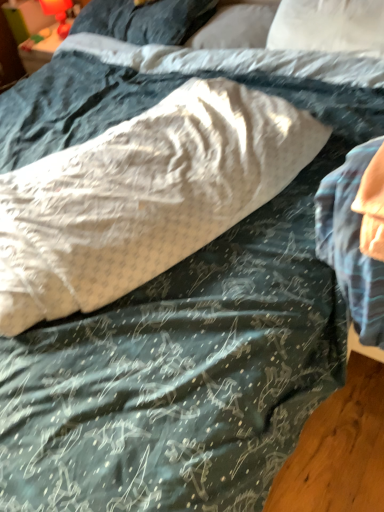
Question: In terms of width, does white textured pillow at center, which appears as the fourth pillow when viewed from the top, look wider or thinner when compared to white soft pillow at upper center, the second pillow in the bottom-to-top sequence?

Choices:
 (A) wide
 (B) thin

Answer: (A)

Question: From the image's perspective, is white textured pillow at center, which appears as the fourth pillow when viewed from the top, located above or below white soft pillow at upper center, which is the third pillow from top to bottom?

Choices:
 (A) below
 (B) above

Answer: (A)

Question: Which object is the farthest from the white textured pillow at center, arranged as the first pillow when ordered from the bottom?

Choices:
 (A) white soft pillow at upper center, which is the third pillow from top to bottom
 (B) white soft pillow at upper center, the second pillow positioned from the top
 (C) soft gray pillow at upper center, placed as the first pillow when sorted from top to bottom

Answer: (C)

Question: Which object is the closest to the white textured pillow at center, arranged as the first pillow when ordered from the bottom?

Choices:
 (A) soft gray pillow at upper center, placed as the first pillow when sorted from top to bottom
 (B) white soft pillow at upper center, the second pillow positioned from the top
 (C) white soft pillow at upper center, the second pillow in the bottom-to-top sequence

Answer: (C)